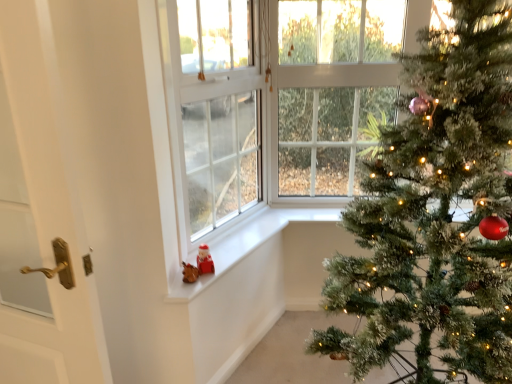
Identify the location of white matte window sill at lower center. (231, 250).

You are a GUI agent. You are given a task and a screenshot of the screen. Output one action in this format:
    pyautogui.click(x=<x>, y=<y>)
    Task: Click on the green textured christmas tree at right
    The width and height of the screenshot is (512, 384).
    Given the screenshot: What is the action you would take?
    pyautogui.click(x=436, y=213)

Image resolution: width=512 pixels, height=384 pixels. What do you see at coordinates (214, 109) in the screenshot?
I see `white plastic window screen at lower left` at bounding box center [214, 109].

What do you see at coordinates (48, 208) in the screenshot? I see `white glossy door at left` at bounding box center [48, 208].

Locate an element on the screen. The height and width of the screenshot is (384, 512). white matte window sill at lower center is located at coordinates (231, 250).

Can you tell me how much white matte window sill at lower center and white glossy door at left differ in facing direction?

They differ by 79.7 degrees in their facing directions.

From the picture: Can you confirm if white matte window sill at lower center is bigger than white glossy door at left?

Incorrect, white matte window sill at lower center is not larger than white glossy door at left.

From the image's perspective, is white matte window sill at lower center located above or below white glossy door at left?

From the image's perspective, white matte window sill at lower center appears below white glossy door at left.

Considering the sizes of white matte window sill at lower center and white glossy door at left in the image, is white matte window sill at lower center taller or shorter than white glossy door at left?

Considering their sizes, white matte window sill at lower center has less height than white glossy door at left.

Who is taller, white matte window sill at lower center or white plastic window screen at lower left?

white plastic window screen at lower left.

Is white matte window sill at lower center wider than white plastic window screen at lower left?

Correct, the width of white matte window sill at lower center exceeds that of white plastic window screen at lower left.

Identify the location of christmas tree above the white glossy door at left (from the image's perspective). (436, 213).

Considering the positions of point (5, 312) and point (407, 307), is point (5, 312) closer or farther from the camera than point (407, 307)?

Point (5, 312) appears to be closer to the viewer than point (407, 307).

Which of these two, white glossy door at left or green textured christmas tree at right, is thinner?

Thinner between the two is white glossy door at left.

Could you tell me if white glossy door at left is turned towards green textured christmas tree at right?

No, white glossy door at left is not oriented towards green textured christmas tree at right.

Consider the image. From a real-world perspective, which object rests below the other?

green textured christmas tree at right, from a real-world perspective.

Between green textured christmas tree at right and white plastic window screen at lower left, which one has larger size?

With larger size is green textured christmas tree at right.

From a real-world perspective, is white glossy door at left located higher than white plastic window screen at lower left?

No, from a real-world perspective, white glossy door at left is not on top of white plastic window screen at lower left.

Between white glossy door at left and white plastic window screen at lower left, which one has less height?

Standing shorter between the two is white plastic window screen at lower left.

Between white glossy door at left and white plastic window screen at lower left, which one has larger size?

white plastic window screen at lower left.

Between point (50, 88) and point (232, 216), which one is positioned behind?

The point (232, 216) is farther from the camera.

Is point (211, 184) in front of point (455, 98)?

No.

Between white plastic window screen at lower left and green textured christmas tree at right, which one has less height?

white plastic window screen at lower left.

From a real-world perspective, between white plastic window screen at lower left and green textured christmas tree at right, who is vertically lower?

In real-world perspective, green textured christmas tree at right is lower.

Could you tell me if green textured christmas tree at right is facing white matte window sill at lower center?

No, green textured christmas tree at right is not oriented towards white matte window sill at lower center.

Locate an element on the screen. The width and height of the screenshot is (512, 384). window sill to the left of green textured christmas tree at right is located at coordinates (231, 250).

How much distance is there between green textured christmas tree at right and white matte window sill at lower center?

The distance of green textured christmas tree at right from white matte window sill at lower center is 32.16 inches.

Which is farther, (x=507, y=256) or (x=248, y=243)?

The point (x=248, y=243) is behind.

Identify the location of window sill below the white glossy door at left (from a real-world perspective). (231, 250).

Locate an element on the screen. window sill behind the white plastic window screen at lower left is located at coordinates (231, 250).

From the image, which object appears to be farther from white plastic window screen at lower left, green textured christmas tree at right or white matte window sill at lower center?

The object further to white plastic window screen at lower left is green textured christmas tree at right.

Which object lies nearer to the anchor point white glossy door at left, white matte window sill at lower center or green textured christmas tree at right?

white matte window sill at lower center is positioned closer to the anchor white glossy door at left.

Based on their spatial positions, is white plastic window screen at lower left or green textured christmas tree at right closer to white glossy door at left?

white plastic window screen at lower left is positioned closer to the anchor white glossy door at left.

Which object lies nearer to the anchor point white glossy door at left, green textured christmas tree at right or white plastic window screen at lower left?

Among the two, white plastic window screen at lower left is located nearer to white glossy door at left.

Which object lies further to the anchor point white glossy door at left, green textured christmas tree at right or white matte window sill at lower center?

Based on the image, green textured christmas tree at right appears to be further to white glossy door at left.

Based on their spatial positions, is green textured christmas tree at right or white glossy door at left closer to white plastic window screen at lower left?

Based on the image, green textured christmas tree at right appears to be nearer to white plastic window screen at lower left.

Estimate the real-world distances between objects in this image. Which object is closer to green textured christmas tree at right, white plastic window screen at lower left or white glossy door at left?

white plastic window screen at lower left lies closer to green textured christmas tree at right than the other object.

Consider the image. When comparing their distances from white plastic window screen at lower left, does white glossy door at left or green textured christmas tree at right seem further?

white glossy door at left is further to white plastic window screen at lower left.

At what (x,y) coordinates should I click in order to perform the action: click on window sill between white plastic window screen at lower left and green textured christmas tree at right from left to right. Please return your answer as a coordinate pair (x, y). Looking at the image, I should click on (231, 250).

Where is `window screen between white glossy door at left and green textured christmas tree at right in the horizontal direction`? window screen between white glossy door at left and green textured christmas tree at right in the horizontal direction is located at coordinates (214, 109).

Image resolution: width=512 pixels, height=384 pixels. Identify the location of window sill located between white glossy door at left and green textured christmas tree at right in the left-right direction. (231, 250).

Locate an element on the screen. window screen between white glossy door at left and white matte window sill at lower center in the front-back direction is located at coordinates (214, 109).